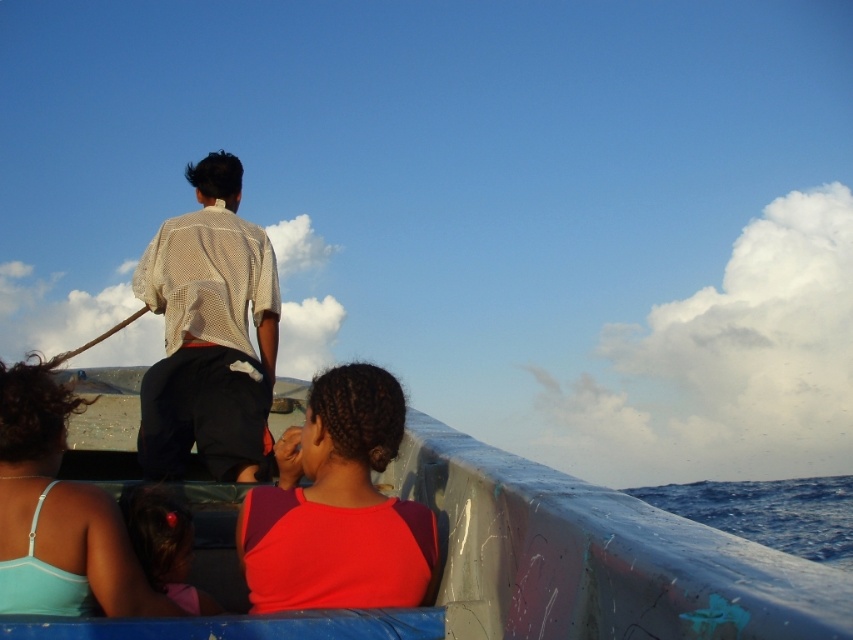
You are a passenger on the boat and want to know if the light beige mesh shirt at upper left is closer to the front or the back of the boat compared to the blue water at lower right. Based on their positions, can you determine which is closer to the front?

The light beige mesh shirt at upper left is located above the blue water at lower right, which means it is positioned closer to the front of the boat since it is higher up in the image.

You are standing on the deck of the boat and want to hand a life jacket to the person wearing the light beige mesh shirt at upper left. If you can reach 10 feet, will you be able to reach them without moving?

The distance between you and the light beige mesh shirt at upper left is 16.85 feet, which is beyond your 10 feet reach. You will need to move closer to hand them the life jacket.

You are navigating a small boat and need to place a lifebuoy on the deck. The lifebuoy must be placed at coordinates closer to the light beige mesh shirt at upper left than to any other object. According to the coordinates provided, where should you place the lifebuoy?

The light beige mesh shirt at upper left is located at point (209, 333). To place the lifebuoy closer to it than any other object, you should position it near those coordinates, ensuring it is nearest to the light beige mesh shirt at upper left.